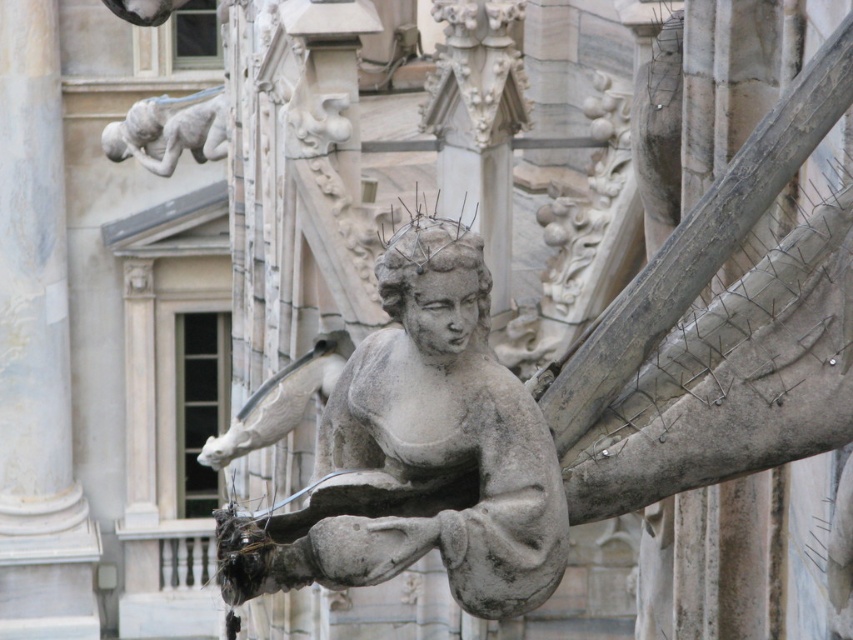
Question: Is gray stone angel at center further to camera compared to gray stone gargoyle at upper left?

Choices:
 (A) no
 (B) yes

Answer: (A)

Question: Does gray stone angel at center have a larger size compared to white marble pillar at center?

Choices:
 (A) no
 (B) yes

Answer: (B)

Question: Where is white marble pillar at center located in relation to gray stone gargoyle at upper left in the image?

Choices:
 (A) left
 (B) right

Answer: (A)

Question: Which point appears farthest from the camera in this image?

Choices:
 (A) (140, 100)
 (B) (44, 419)

Answer: (A)

Question: Among these objects, which one is nearest to the camera?

Choices:
 (A) gray stone angel at center
 (B) white marble pillar at center

Answer: (A)

Question: Which object appears closest to the camera in this image?

Choices:
 (A) gray stone gargoyle at upper left
 (B) gray stone angel at center

Answer: (B)